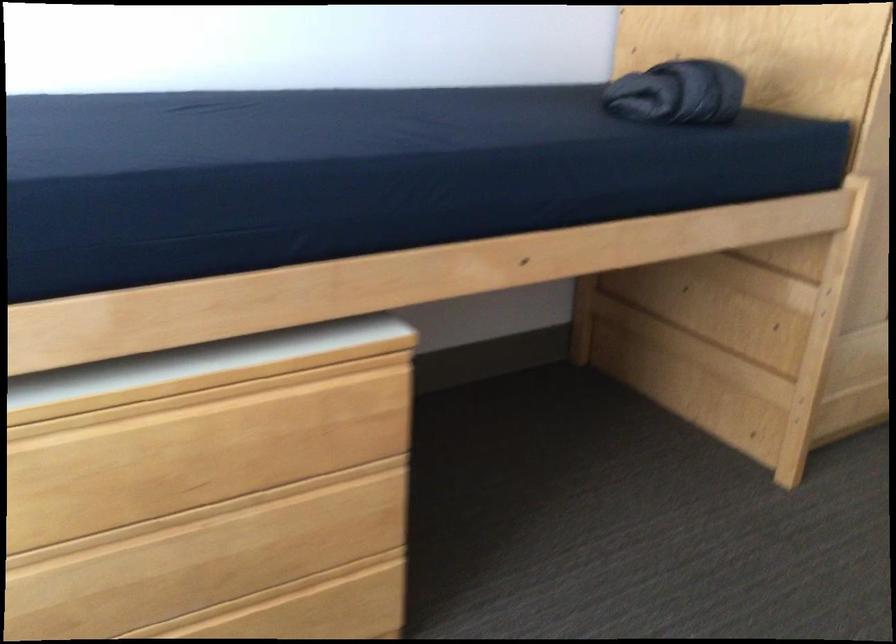
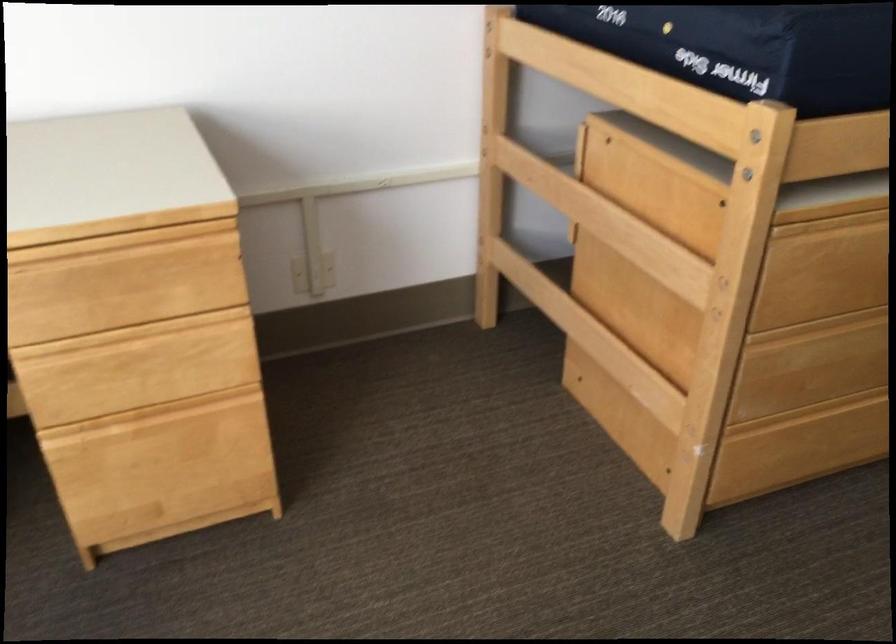
Question: What movement of the cameraman would produce the second image?

Choices:
 (A) Left
 (B) Right
 (C) Forward
 (D) Backward

Answer: (A)